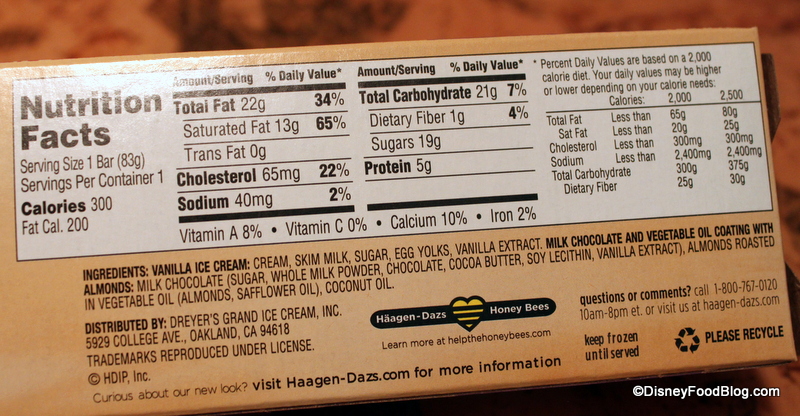
Find the location of a particular element. This screenshot has width=800, height=416. food box is located at coordinates (45, 330).